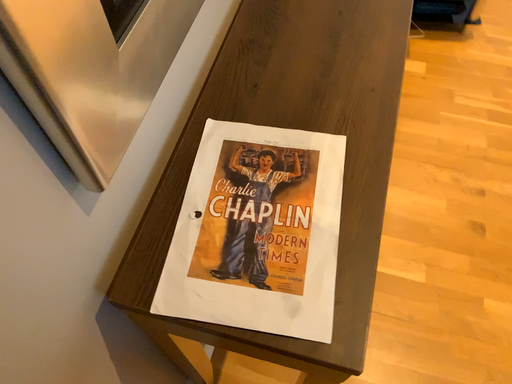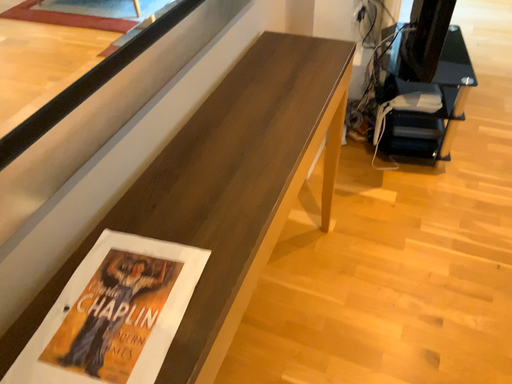
Question: How did the camera likely rotate when shooting the video?

Choices:
 (A) rotated downward
 (B) rotated upward

Answer: (B)